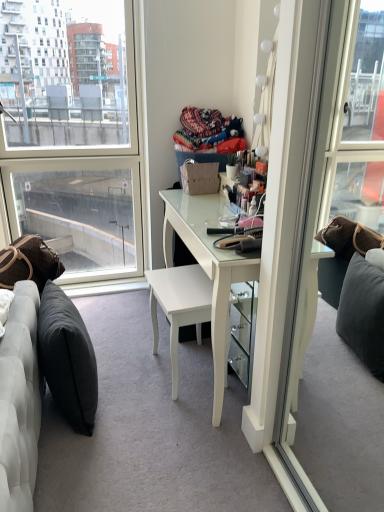
The image size is (384, 512). Describe the element at coordinates (67, 358) in the screenshot. I see `dark gray fabric pillow at lower left, the second pillow viewed from the left` at that location.

I want to click on white glossy desk at center, so click(x=208, y=266).

In the scene shown: Can you confirm if brown leather pillow at lower left, which is counted as the 1th pillow, starting from the left, is smaller than white glossy chair at center?

Yes, brown leather pillow at lower left, which is counted as the 1th pillow, starting from the left, is smaller than white glossy chair at center.

Is brown leather pillow at lower left, arranged as the second pillow when viewed from the right, thinner than white glossy chair at center?

No.

From the image's perspective, which is below, brown leather pillow at lower left, which is counted as the 1th pillow, starting from the left, or white glossy chair at center?

white glossy chair at center appears lower in the image.

Considering the positions of objects white glossy chair at center and white glossy desk at center in the image provided, who is behind, white glossy chair at center or white glossy desk at center?

white glossy chair at center is further away from the camera.

Is white glossy chair at center completely or partially outside of white glossy desk at center?

Actually, white glossy chair at center is within white glossy desk at center.

Based on their sizes in the image, would you say white glossy chair at center is bigger or smaller than white glossy desk at center?

Clearly, white glossy chair at center is smaller in size than white glossy desk at center.

Between point (181, 303) and point (195, 215), which one is positioned behind?

Positioned behind is point (195, 215).

Could you tell me if white glossy desk at center is turned towards transparent glass window at left?

No, white glossy desk at center is not facing towards transparent glass window at left.

How different are the orientations of white glossy desk at center and transparent glass window at left in degrees?

88.9 degrees.

Is white glossy desk at center taller than transparent glass window at left?

No.

Is point (184, 195) positioned after point (133, 62)?

No, it is not.

Is the surface of white glossy desk at center in direct contact with brown leather pillow at lower left, which is counted as the 1th pillow, starting from the left?

No, white glossy desk at center is not touching brown leather pillow at lower left, which is counted as the 1th pillow, starting from the left.

Can you confirm if white glossy desk at center is wider than brown leather pillow at lower left, which is counted as the 1th pillow, starting from the left?

Indeed, white glossy desk at center has a greater width compared to brown leather pillow at lower left, which is counted as the 1th pillow, starting from the left.

Between point (178, 221) and point (13, 242), which one is positioned behind?

Point (13, 242)

From the image's perspective, is white glossy desk at center located above or below brown leather pillow at lower left, arranged as the second pillow when viewed from the right?

white glossy desk at center is situated lower than brown leather pillow at lower left, arranged as the second pillow when viewed from the right, in the image.

Which object is further away from the camera, white glossy desk at center or white glossy chair at center?

white glossy chair at center is behind.

Based on the photo, what's the angular difference between white glossy desk at center and white glossy chair at center's facing directions?

The angle between the facing direction of white glossy desk at center and the facing direction of white glossy chair at center is 177 degrees.

Is point (211, 270) farther from viewer compared to point (199, 276)?

No, it is in front of (199, 276).

Measure the distance from transparent glass window at left to white glossy chair at center.

transparent glass window at left and white glossy chair at center are 1.22 meters apart from each other.

Would you say transparent glass window at left is a long distance from white glossy chair at center?

Yes, transparent glass window at left and white glossy chair at center are quite far apart.

Which is closer to the camera, (106, 227) or (181, 280)?

The point (181, 280) is closer to the camera.

Identify the location of chair that appears in front of the transparent glass window at left. (179, 305).

Does point (85, 400) come behind point (171, 362)?

No, it is not.

Who is taller, dark gray fabric pillow at lower left, the second pillow viewed from the left, or white glossy chair at center?

dark gray fabric pillow at lower left, the second pillow viewed from the left.

Can you confirm if dark gray fabric pillow at lower left, the second pillow viewed from the left, is positioned to the right of white glossy chair at center?

In fact, dark gray fabric pillow at lower left, the second pillow viewed from the left, is to the left of white glossy chair at center.

Could white glossy chair at center be considered to be inside dark gray fabric pillow at lower left, arranged as the 1th pillow when viewed from the right?

That's incorrect, white glossy chair at center is not inside dark gray fabric pillow at lower left, arranged as the 1th pillow when viewed from the right.

Find the location of `chair lying on the right of brown leather pillow at lower left, arranged as the second pillow when viewed from the right`. chair lying on the right of brown leather pillow at lower left, arranged as the second pillow when viewed from the right is located at coordinates (179, 305).

In the image, there is a white glossy chair at center. What are the coordinates of `desk above it (from the image's perspective)` in the screenshot? It's located at (208, 266).

Which object lies further to the anchor point white glossy desk at center, dark gray fabric pillow at lower left, the second pillow viewed from the left, or transparent glass window at left?

Based on the image, transparent glass window at left appears to be further to white glossy desk at center.

Looking at the image, which one is located closer to brown leather pillow at lower left, arranged as the second pillow when viewed from the right, transparent glass window at left or dark gray fabric pillow at lower left, the second pillow viewed from the left?

The object closer to brown leather pillow at lower left, arranged as the second pillow when viewed from the right, is dark gray fabric pillow at lower left, the second pillow viewed from the left.

When comparing their distances from transparent glass window at left, does dark gray fabric pillow at lower left, the second pillow viewed from the left, or white glossy desk at center seem closer?

The object closer to transparent glass window at left is white glossy desk at center.

Based on their spatial positions, is transparent glass window at left or dark gray fabric pillow at lower left, arranged as the 1th pillow when viewed from the right, closer to white glossy chair at center?

dark gray fabric pillow at lower left, arranged as the 1th pillow when viewed from the right, is positioned closer to the anchor white glossy chair at center.

When comparing their distances from white glossy chair at center, does brown leather pillow at lower left, arranged as the second pillow when viewed from the right, or dark gray fabric pillow at lower left, the second pillow viewed from the left, seem further?

Among the two, brown leather pillow at lower left, arranged as the second pillow when viewed from the right, is located further to white glossy chair at center.

From the picture: Which object lies nearer to the anchor point white glossy desk at center, brown leather pillow at lower left, arranged as the second pillow when viewed from the right, or transparent glass window at left?

The object closer to white glossy desk at center is brown leather pillow at lower left, arranged as the second pillow when viewed from the right.

Looking at the image, which one is located closer to white glossy chair at center, brown leather pillow at lower left, which is counted as the 1th pillow, starting from the left, or transparent glass window at left?

brown leather pillow at lower left, which is counted as the 1th pillow, starting from the left, is closer to white glossy chair at center.

Considering their positions, is brown leather pillow at lower left, which is counted as the 1th pillow, starting from the left, positioned further to transparent glass window at left than dark gray fabric pillow at lower left, arranged as the 1th pillow when viewed from the right?

dark gray fabric pillow at lower left, arranged as the 1th pillow when viewed from the right.

You are a GUI agent. You are given a task and a screenshot of the screen. Output one action in this format:
    pyautogui.click(x=<x>, y=<y>)
    Task: Click on the chair located between brown leather pillow at lower left, arranged as the second pillow when viewed from the right, and white glossy desk at center in the left-right direction
    
    Given the screenshot: What is the action you would take?
    pyautogui.click(x=179, y=305)

Locate an element on the screen. This screenshot has height=512, width=384. pillow between brown leather pillow at lower left, arranged as the second pillow when viewed from the right, and white glossy desk at center from left to right is located at coordinates (67, 358).

You are a GUI agent. You are given a task and a screenshot of the screen. Output one action in this format:
    pyautogui.click(x=<x>, y=<y>)
    Task: Click on the pillow between transparent glass window at left and white glossy chair at center from top to bottom
    This screenshot has width=384, height=512.
    Given the screenshot: What is the action you would take?
    pyautogui.click(x=29, y=262)

What are the coordinates of `pillow that lies between transparent glass window at left and dark gray fabric pillow at lower left, arranged as the 1th pillow when viewed from the right, from top to bottom` in the screenshot? It's located at (29, 262).